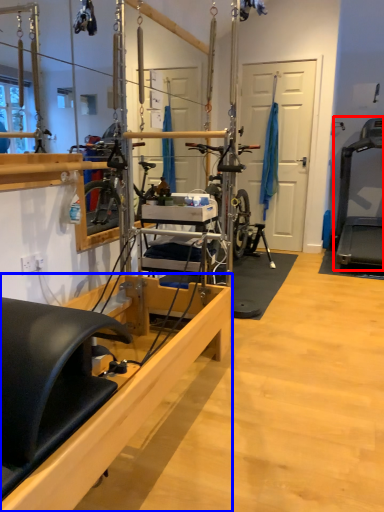
Question: Which object is closer to the camera taking this photo, treadmill (highlighted by a red box) or furniture (highlighted by a blue box)?

Choices:
 (A) treadmill
 (B) furniture

Answer: (B)